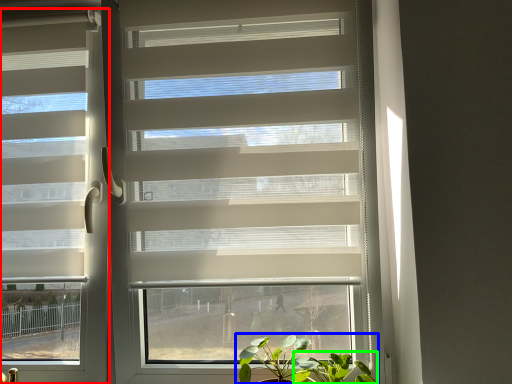
Question: Which object is the farthest from window blind (highlighted by a red box)? Choose among these: houseplant (highlighted by a blue box) or vegetation (highlighted by a green box).

Choices:
 (A) houseplant
 (B) vegetation

Answer: (B)